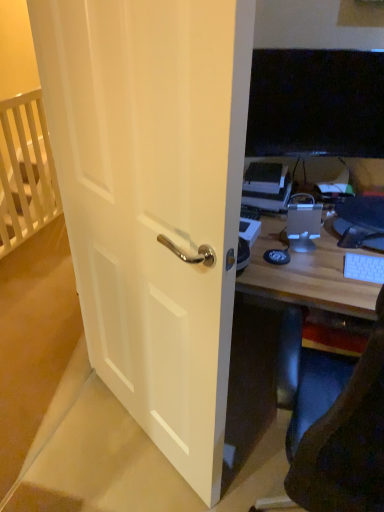
Locate an element on the screen. This screenshot has width=384, height=512. vacant space situated on the left part of black rubber mousepad at center is located at coordinates tap(253, 261).